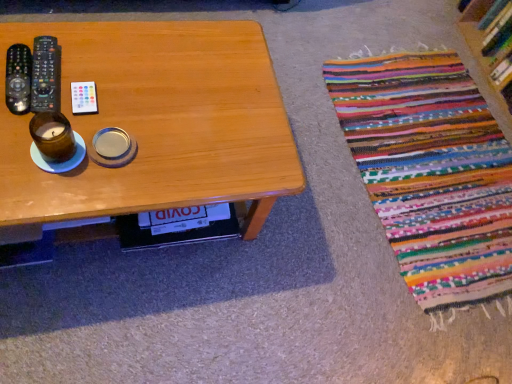
You are a GUI agent. You are given a task and a screenshot of the screen. Output one action in this format:
    pyautogui.click(x=<x>, y=<y>)
    Task: Click on the vacant area in front of wooden bookshelf at upper right
    This screenshot has height=384, width=512.
    Given the screenshot: What is the action you would take?
    pyautogui.click(x=466, y=117)